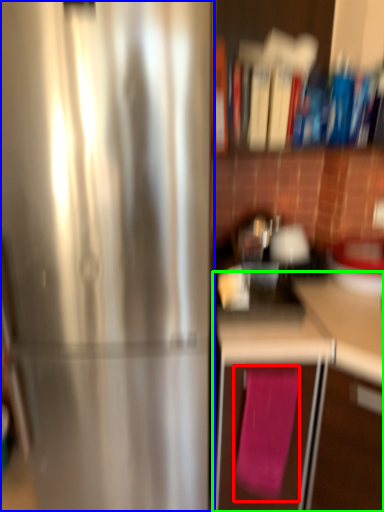
Question: Which object is the closest to the bath towel (highlighted by a red box)? Choose among these: refrigerator (highlighted by a blue box) or cabinetry (highlighted by a green box).

Choices:
 (A) refrigerator
 (B) cabinetry

Answer: (B)